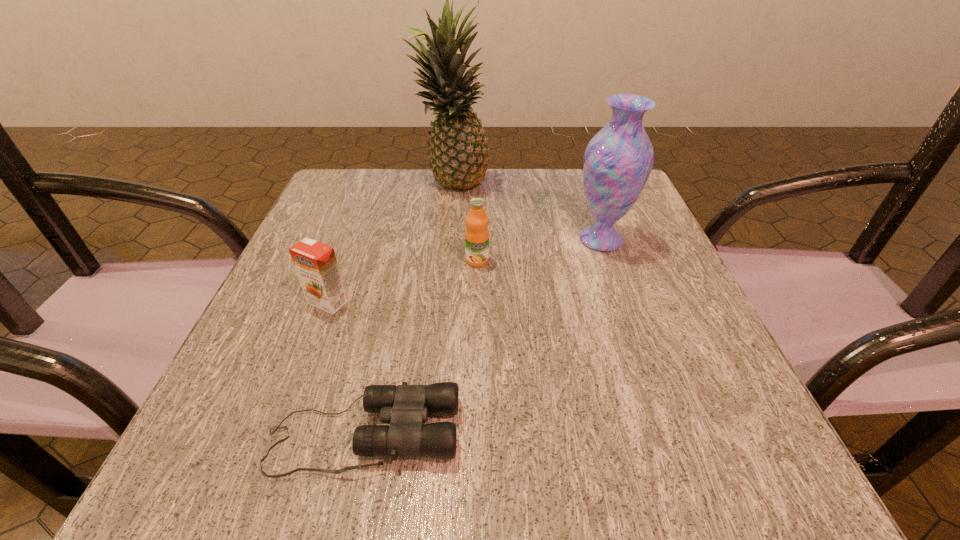
The image size is (960, 540). I want to click on free spot between the vase and the farther orange juice, so click(x=540, y=250).

Locate an element on the screen. This screenshot has width=960, height=540. free spot between the farthest object and the nearer orange juice is located at coordinates (390, 244).

Where is `vacant point located between the right orange juice and the shortest object`? This screenshot has width=960, height=540. vacant point located between the right orange juice and the shortest object is located at coordinates (420, 347).

Where is `blank region between the shortest object and the farther orange juice`? This screenshot has height=540, width=960. blank region between the shortest object and the farther orange juice is located at coordinates (420, 347).

Locate an element on the screen. The image size is (960, 540). free area in between the nearer orange juice and the tallest object is located at coordinates (390, 244).

Identify the location of object identified as the second closest to the farther orange juice. The image size is (960, 540). pos(459,158).

Image resolution: width=960 pixels, height=540 pixels. Find the location of `object that is the fourth closest one to the left orange juice`. object that is the fourth closest one to the left orange juice is located at coordinates (618, 160).

You are a GUI agent. You are given a task and a screenshot of the screen. Output one action in this format:
    pyautogui.click(x=<x>, y=<y>)
    Task: Click on the vacant space that satisfies the following two spatial constraints: 1. on the label of the right orange juice; 2. at the eyepiece of the binoculars
    
    Given the screenshot: What is the action you would take?
    point(476,434)

Find the location of `free spot that satisfies the following two spatial constraints: 1. on the label of the farther orange juice; 2. at the eyepiece of the binoculars`. free spot that satisfies the following two spatial constraints: 1. on the label of the farther orange juice; 2. at the eyepiece of the binoculars is located at coordinates (476, 434).

This screenshot has height=540, width=960. In order to click on vacant space that satisfies the following two spatial constraints: 1. on the front side of the vase; 2. on the left side of the pineapple in this screenshot , I will do (x=446, y=240).